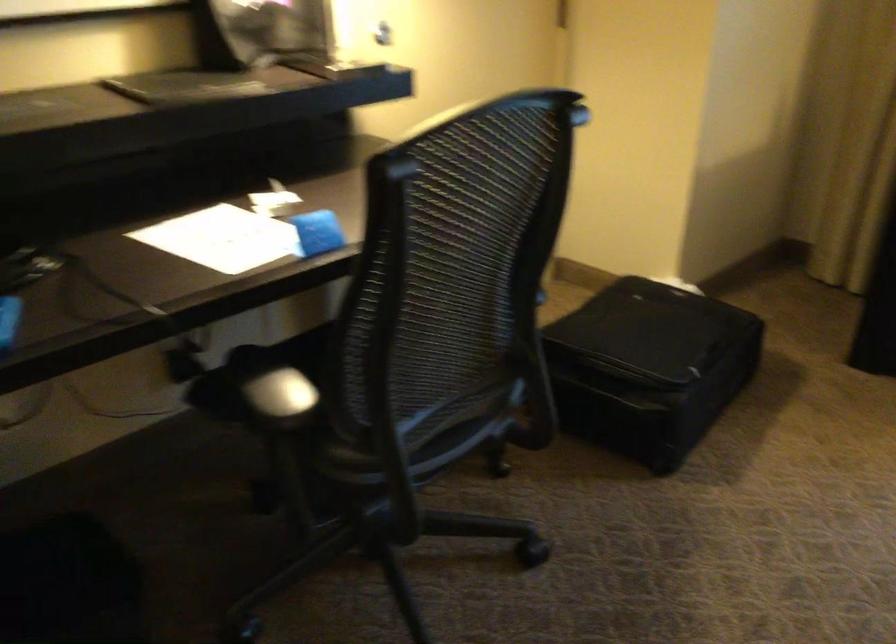
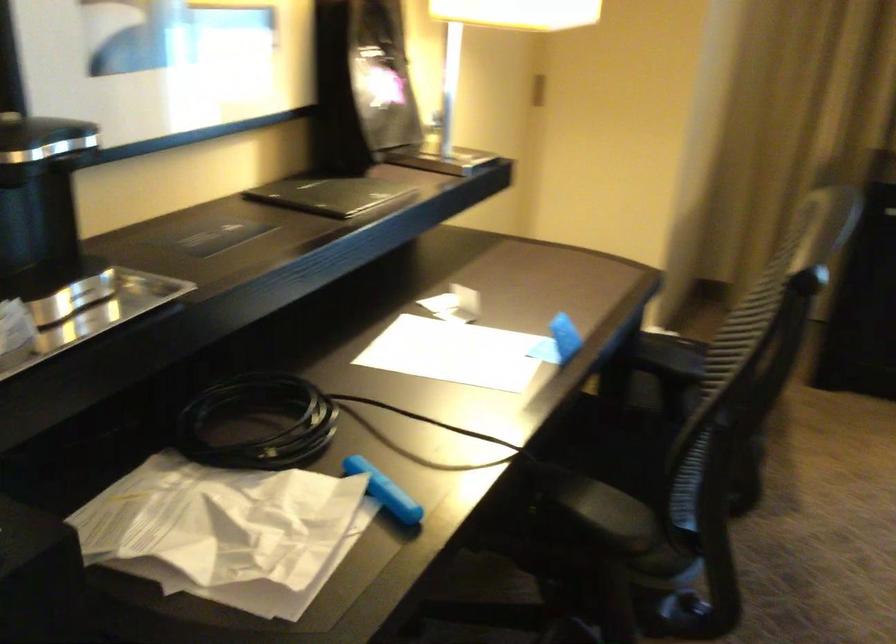
Find the pixel in the second image that matches the point at 383,518 in the first image.

(679, 614)